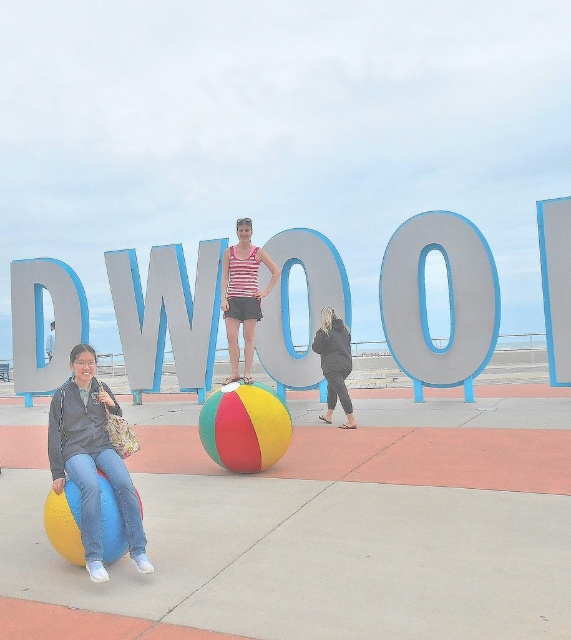
Between gray plastic letter o at center and matte plastic letter w at center, which one is positioned higher?

gray plastic letter o at center

Can you confirm if gray plastic letter o at center is taller than matte plastic letter w at center?

Yes, gray plastic letter o at center is taller than matte plastic letter w at center.

Is point (481, 369) farther from camera compared to point (187, 344)?

No, (481, 369) is in front of (187, 344).

Locate an element on the screen. The height and width of the screenshot is (640, 571). gray plastic letter o at center is located at coordinates (448, 300).

Does brushed metal letter d at upper left have a greater width compared to matte gray letter w at center?

Correct, the width of brushed metal letter d at upper left exceeds that of matte gray letter w at center.

Measure the distance between brushed metal letter d at upper left and camera.

brushed metal letter d at upper left is 14.72 meters from camera.

This screenshot has height=640, width=571. I want to click on brushed metal letter d at upper left, so click(x=42, y=323).

Between point (132, 282) and point (73, 518), which one is positioned in front?

Positioned in front is point (73, 518).

Which is more to the right, matte gray letter w at center or multicolored rubber beach ball at lower left?

From the viewer's perspective, multicolored rubber beach ball at lower left appears more on the right side.

Is point (126, 330) behind point (66, 538)?

Yes, point (126, 330) is behind point (66, 538).

Find the location of a particular element. This screenshot has height=640, width=571. matte gray letter w at center is located at coordinates (136, 321).